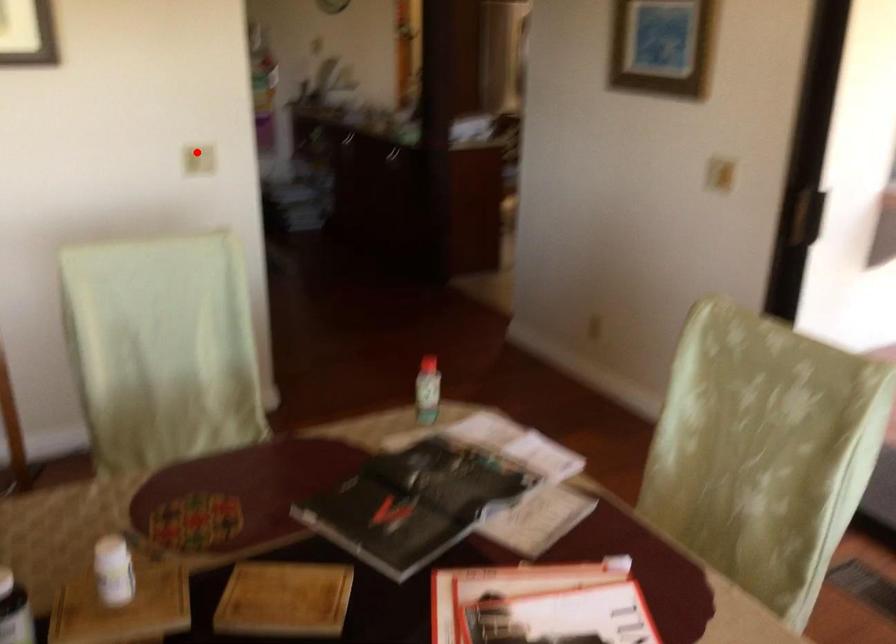
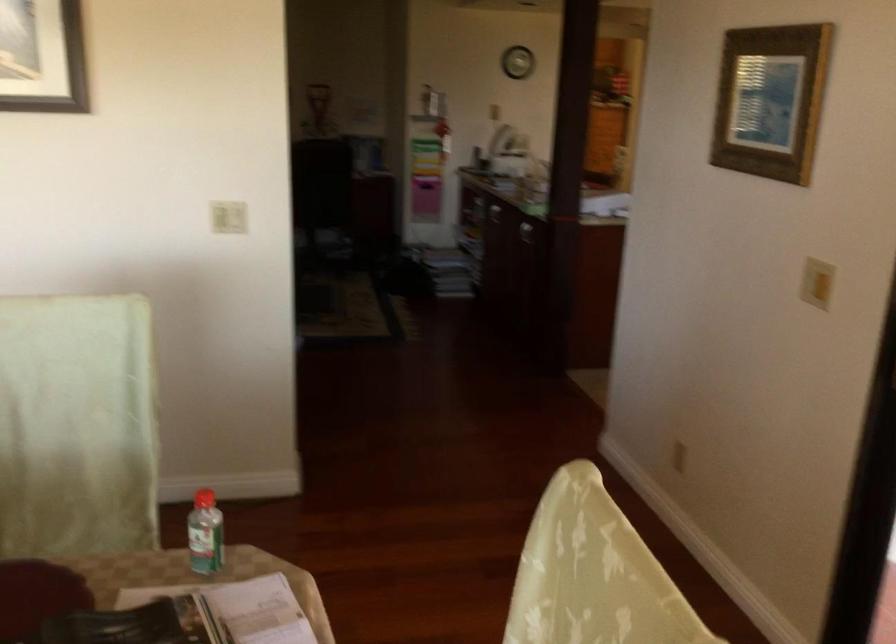
Find the pixel in the second image that matches the highlighted location in the first image.

(228, 216)